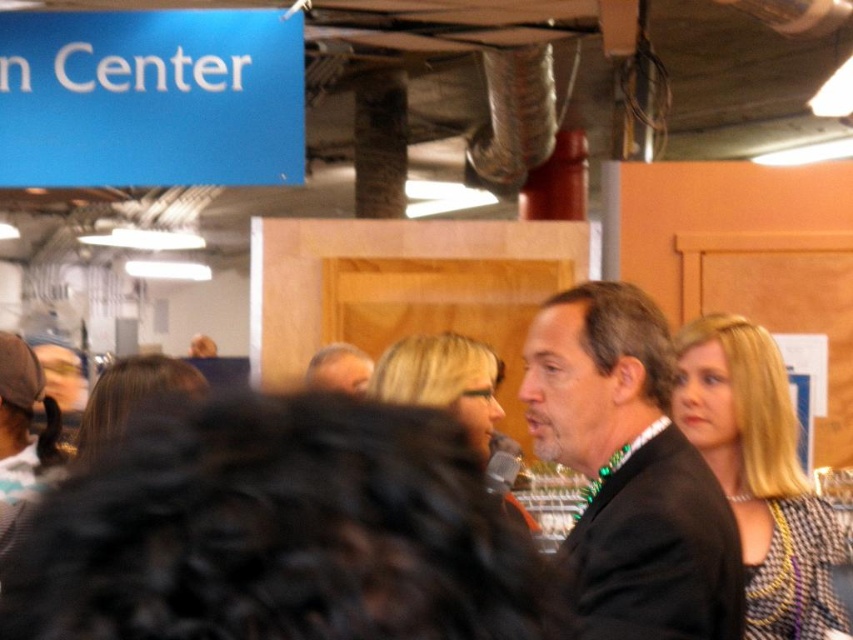
Who is more forward, (550,364) or (341,369)?

Point (550,364) is in front.

Does black suit at center have a greater width compared to light brown hair at center?

Yes, black suit at center is wider than light brown hair at center.

What are the coordinates of `black suit at center` in the screenshot? It's located at (630, 472).

Does wooden bulletin board at right have a smaller size compared to light brown hair at center?

No.

Is point (679, 257) positioned behind point (360, 380)?

Yes, it is.

Between point (816, 237) and point (328, 364), which one is positioned behind?

The point (816, 237) is more distant.

Where is `wooden bulletin board at right`? This screenshot has height=640, width=853. wooden bulletin board at right is located at coordinates (786, 316).

Which is in front, point (590, 317) or point (843, 358)?

Positioned in front is point (590, 317).

Between black suit at center and wooden bulletin board at right, which one is positioned higher?

wooden bulletin board at right is above.

Does point (677, 608) come farther from viewer compared to point (825, 355)?

No, (677, 608) is in front of (825, 355).

The width and height of the screenshot is (853, 640). I want to click on black suit at center, so click(630, 472).